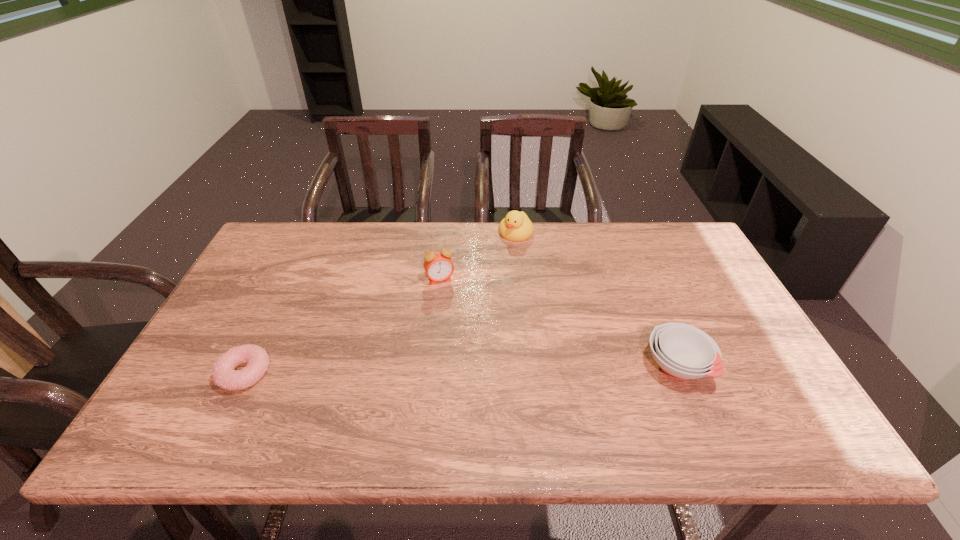
Choose which object is the second nearest neighbor to the doughnut. Please provide its 2D coordinates. Your answer should be formatted as a tuple, i.e. [(x, y)], where the tuple contains the x and y coordinates of a point satisfying the conditions above.

[(516, 226)]

This screenshot has height=540, width=960. In order to click on vacant space that satisfies the following two spatial constraints: 1. on the back side of the alarm clock; 2. on the right side of the duckling in this screenshot , I will do `click(444, 233)`.

Find the location of a particular element. vacant space that satisfies the following two spatial constraints: 1. on the front side of the tallest object; 2. on the right side of the rightmost object is located at coordinates (431, 366).

The height and width of the screenshot is (540, 960). Find the location of `free space that satisfies the following two spatial constraints: 1. on the front side of the third object from left to right; 2. on the right side of the soup bowl`. free space that satisfies the following two spatial constraints: 1. on the front side of the third object from left to right; 2. on the right side of the soup bowl is located at coordinates (530, 366).